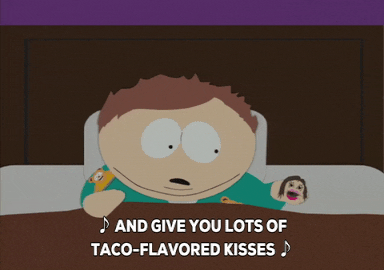
Image resolution: width=384 pixels, height=270 pixels. I want to click on pillow, so click(256, 161).